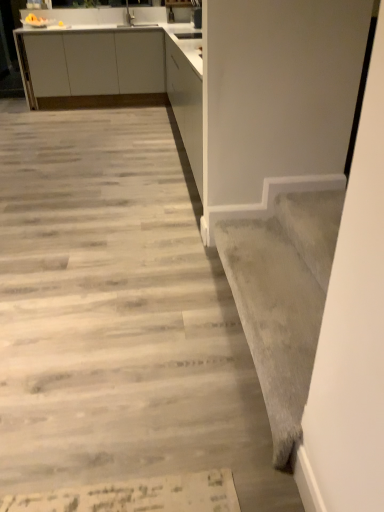
Question: Visually, is gray carpet at lower right positioned to the left or to the right of gray wood floor at center?

Choices:
 (A) right
 (B) left

Answer: (A)

Question: From the image's perspective, is gray carpet at lower right positioned above or below gray wood floor at center?

Choices:
 (A) above
 (B) below

Answer: (B)

Question: Considering the real-world distances, which object is farthest from the gray carpet at lower right?

Choices:
 (A) white matte cabinet at upper left
 (B) gray wood floor at center

Answer: (A)

Question: Which object is the farthest from the white matte cabinet at upper left?

Choices:
 (A) gray wood floor at center
 (B) gray carpet at lower right

Answer: (B)